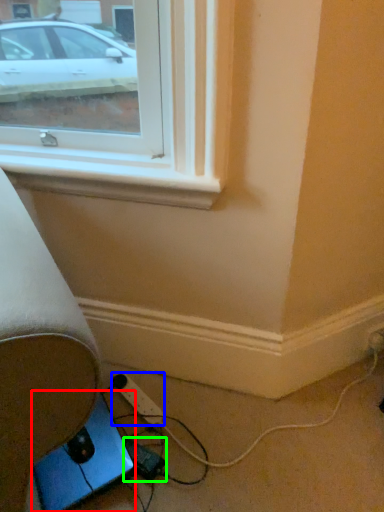
Question: Considering the real-world distances, which object is farthest from gadget (highlighted by a red box)? extension cord (highlighted by a blue box) or extension cord (highlighted by a green box)?

Choices:
 (A) extension cord
 (B) extension cord

Answer: (A)